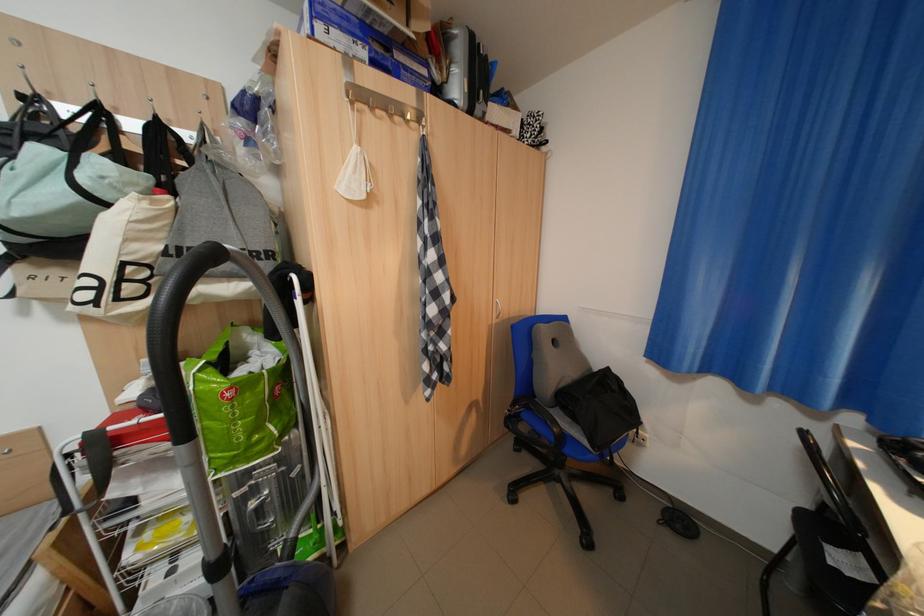
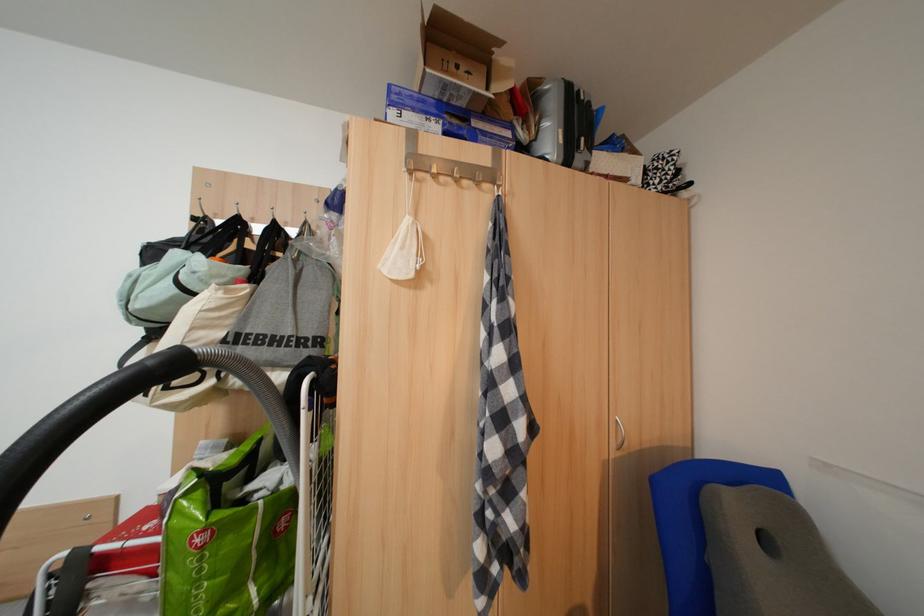
In the second image, find the point that corresponds to (152,217) in the first image.

(224, 307)